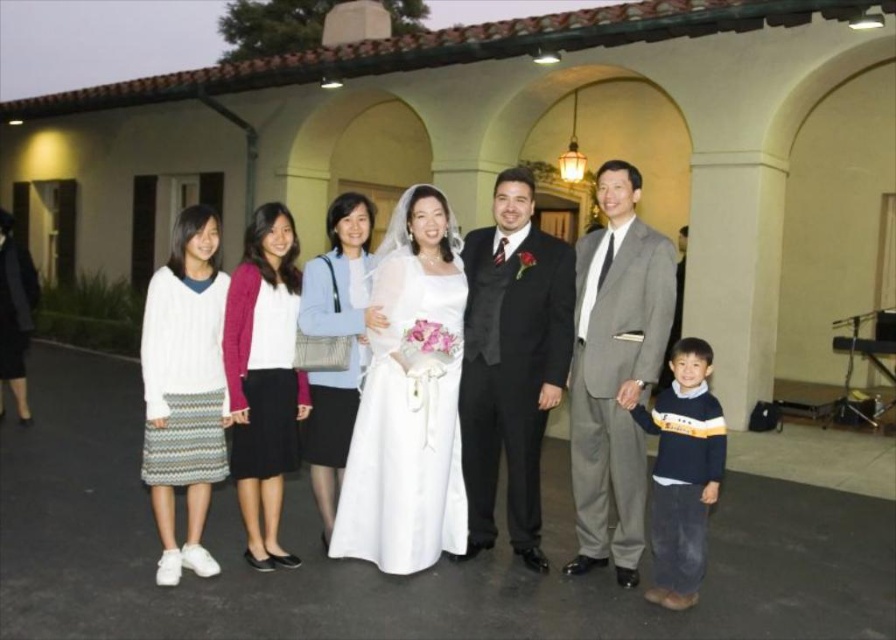
Question: Does shiny black suit at center appear under gray suit at right?

Choices:
 (A) no
 (B) yes

Answer: (B)

Question: Which point is closer to the camera?

Choices:
 (A) (225, 465)
 (B) (254, 326)

Answer: (A)

Question: Does shiny black suit at center appear on the left side of white knitted dress at left?

Choices:
 (A) no
 (B) yes

Answer: (A)

Question: Which point is closer to the camera taking this photo?

Choices:
 (A) (596, 371)
 (B) (672, 506)
 (C) (416, 257)
 (D) (242, 502)

Answer: (B)

Question: Observing the image, what is the correct spatial positioning of shiny black suit at center in reference to white knit sweater at left?

Choices:
 (A) left
 (B) right

Answer: (B)

Question: Among these points, which one is nearest to the camera?

Choices:
 (A) (604, 339)
 (B) (371, 493)
 (C) (231, 285)

Answer: (C)